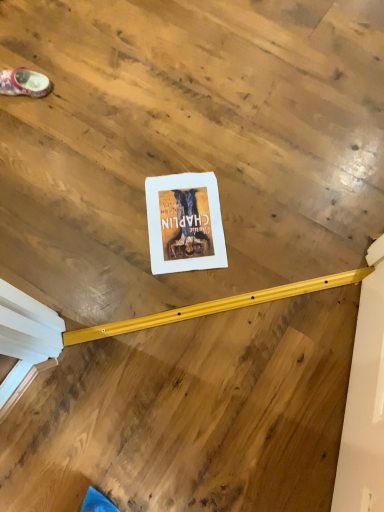
Find the location of a particular element. The height and width of the screenshot is (512, 384). blank space situated above white paper at center (from a real-world perspective) is located at coordinates point(185,219).